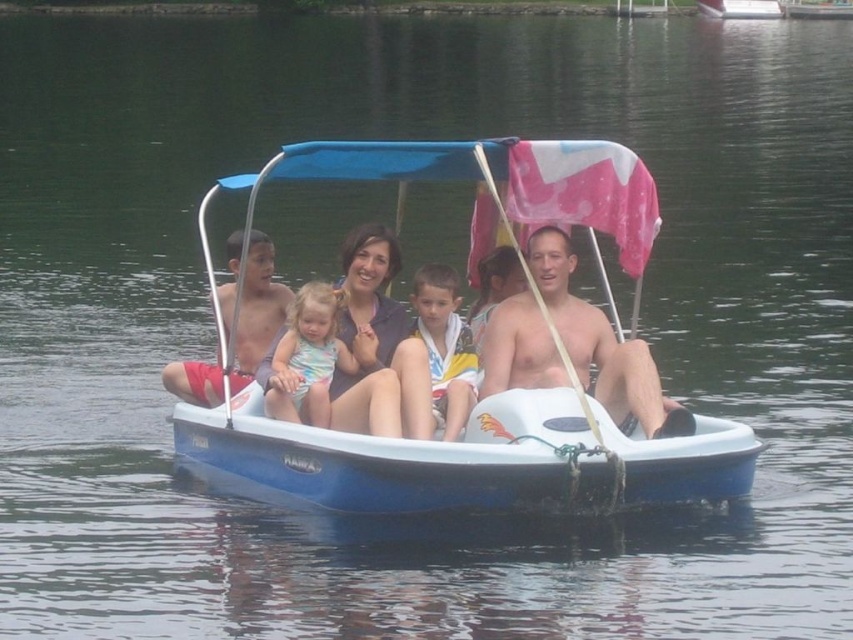
Looking at this image, is shiny skin man at center positioned in front of matte red shorts at center?

Yes, shiny skin man at center is in front of matte red shorts at center.

Who is more forward, (669, 428) or (253, 284)?

Point (669, 428)

Image resolution: width=853 pixels, height=640 pixels. Describe the element at coordinates (601, 346) in the screenshot. I see `shiny skin man at center` at that location.

This screenshot has width=853, height=640. In order to click on shiny skin man at center in this screenshot , I will do `click(601, 346)`.

Does matte black swimsuit at center appear on the left side of multicolored striped towel at center?

Indeed, matte black swimsuit at center is positioned on the left side of multicolored striped towel at center.

Does matte black swimsuit at center come in front of multicolored striped towel at center?

Yes, it is.

Between point (339, 417) and point (424, 333), which one is positioned behind?

Point (424, 333)

Find the location of `matte black swimsuit at center`. matte black swimsuit at center is located at coordinates (370, 336).

Can you confirm if blue plastic boat at center is positioned above pastel floral swimsuit at center?

Indeed, blue plastic boat at center is positioned over pastel floral swimsuit at center.

Is blue plastic boat at center smaller than pastel floral swimsuit at center?

Actually, blue plastic boat at center might be larger than pastel floral swimsuit at center.

This screenshot has height=640, width=853. What do you see at coordinates (474, 458) in the screenshot?
I see `blue plastic boat at center` at bounding box center [474, 458].

This screenshot has width=853, height=640. In order to click on blue plastic boat at center in this screenshot , I will do `click(474, 458)`.